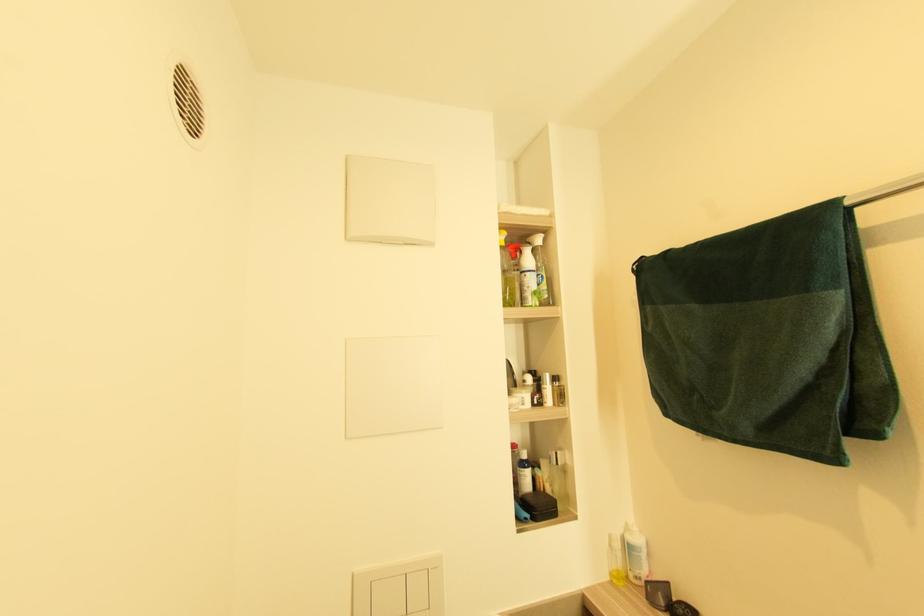
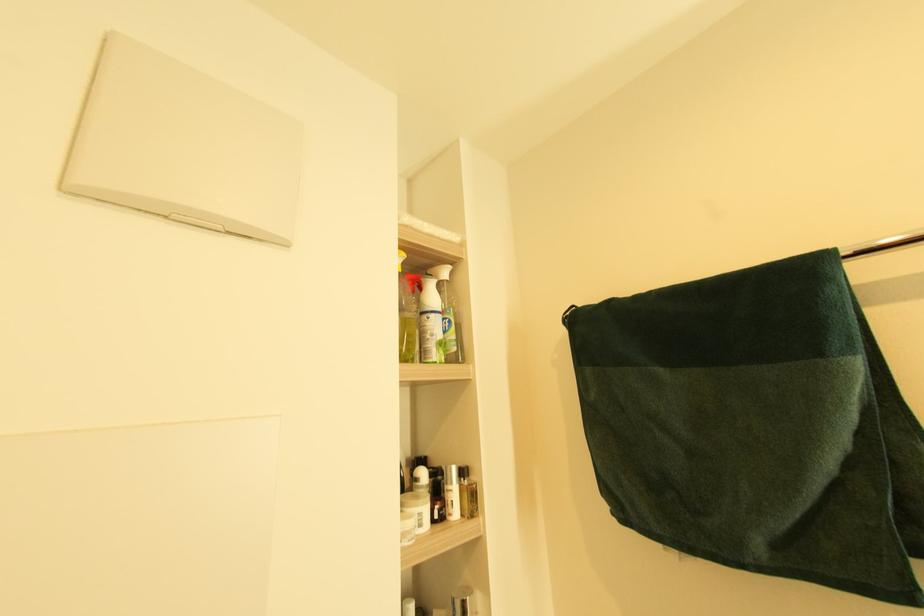
Question: The camera is either moving clockwise (left) or counter-clockwise (right) around the object. The first image is from the beginning of the video and the second image is from the end. Is the camera moving left or right when shooting the video?

Choices:
 (A) Left
 (B) Right

Answer: (A)